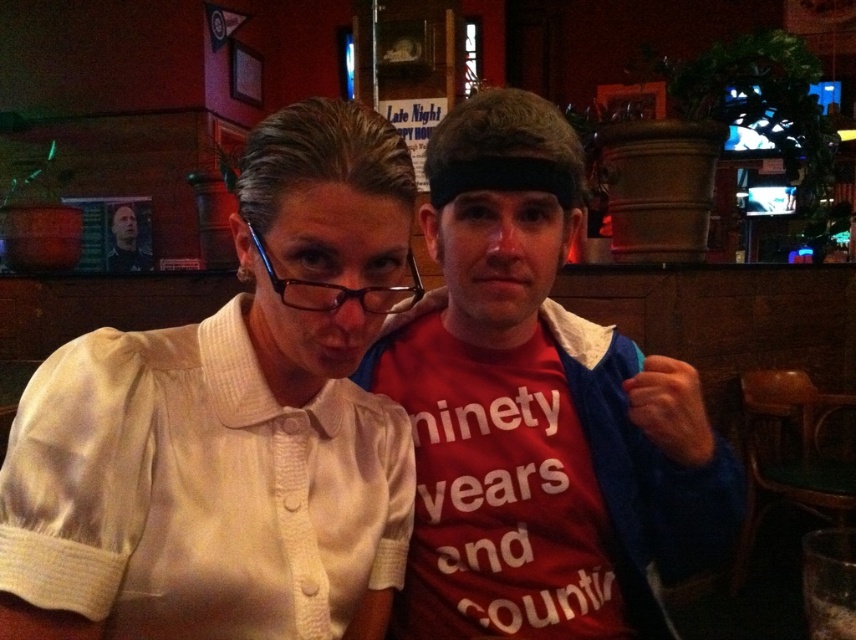
You are a photographer trying to capture a candid shot of the white satin blouse at center and the matte black hair at upper left. Which object should you focus on first if you want to ensure both are in sharp focus, considering their relative heights?

The white satin blouse at center is taller than the matte black hair at upper left, so you should focus on the white satin blouse at center first to ensure both are in sharp focus.